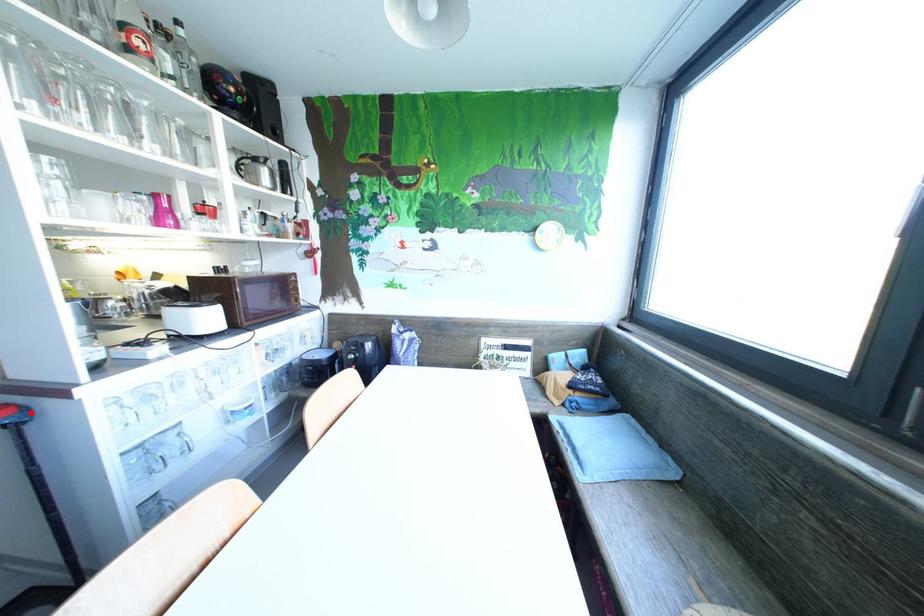
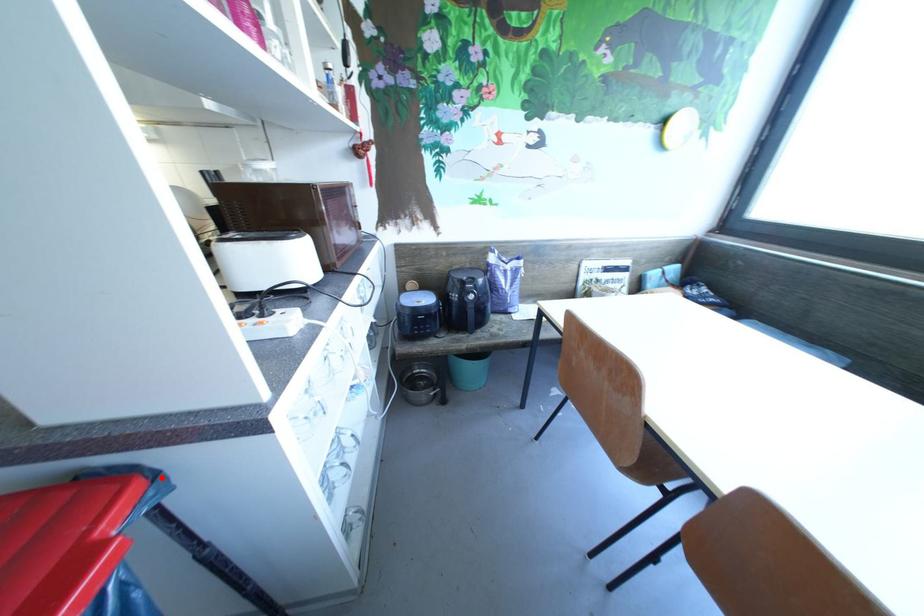
I am providing you with two images of the same scene from different viewpoints. A red point is marked on the first image and another point is marked on the second image. Is the marked point in image1 the same physical position as the marked point in image2?

Yes